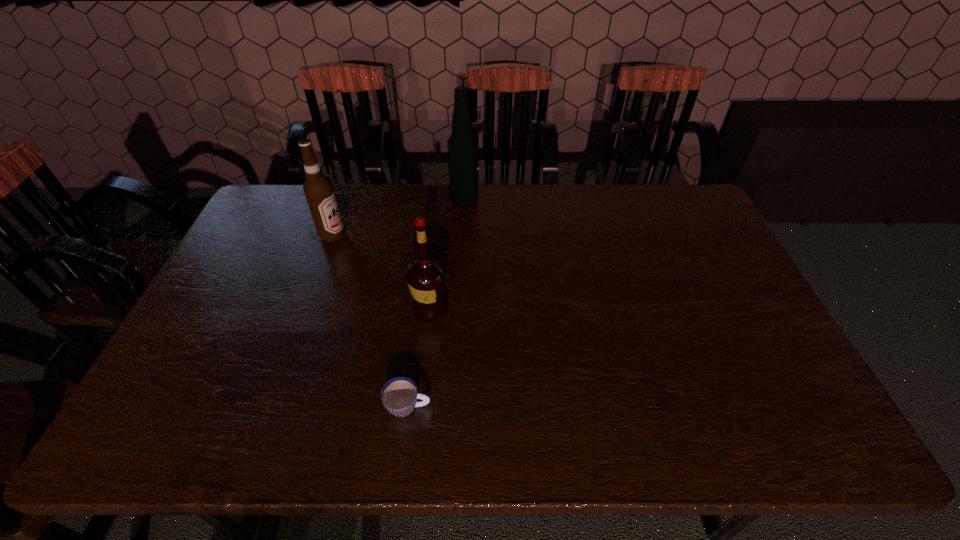
Find the location of a particular element. The width and height of the screenshot is (960, 540). the tallest alcohol is located at coordinates coord(463,147).

Where is `the tallest object`? The image size is (960, 540). the tallest object is located at coordinates (463, 147).

This screenshot has width=960, height=540. In order to click on the third nearest object in this screenshot , I will do `click(318, 189)`.

Locate an element on the screen. The width and height of the screenshot is (960, 540). the leftmost alcohol is located at coordinates (318, 189).

What are the coordinates of `the second nearest object` in the screenshot? It's located at (426, 276).

Where is `the nearest object`? The height and width of the screenshot is (540, 960). the nearest object is located at coordinates (399, 395).

I want to click on the shortest object, so click(x=399, y=395).

The width and height of the screenshot is (960, 540). In order to click on vacant space located 0.070m on the left of the tallest object in this screenshot , I will do tap(431, 201).

You are a GUI agent. You are given a task and a screenshot of the screen. Output one action in this format:
    pyautogui.click(x=<x>, y=<y>)
    Task: Click on the free space located 0.240m on the label of the leftmost alcohol
    
    Given the screenshot: What is the action you would take?
    pyautogui.click(x=418, y=235)

The width and height of the screenshot is (960, 540). Find the location of `vacant space positioned 0.100m on the label of the nearest alcohol`. vacant space positioned 0.100m on the label of the nearest alcohol is located at coordinates (485, 308).